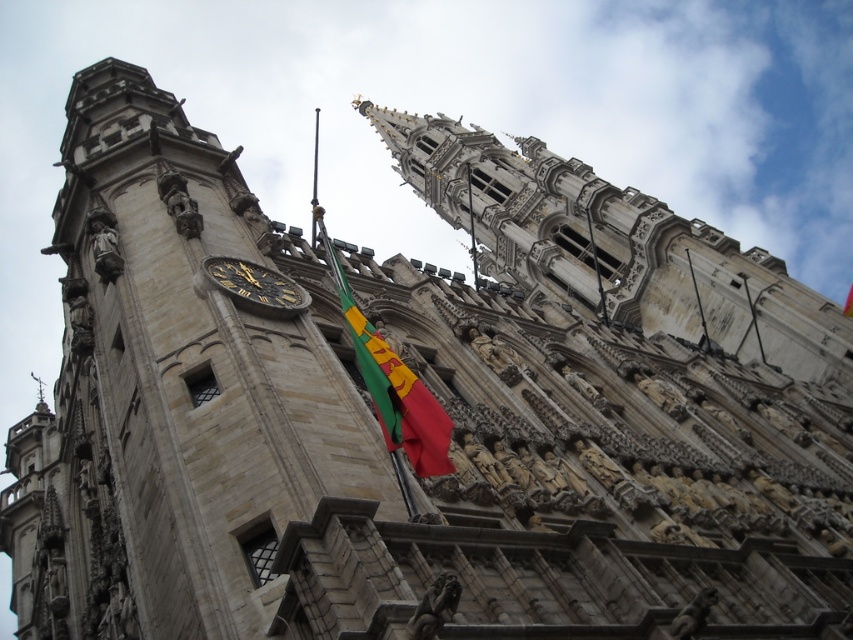
Question: Among these objects, which one is nearest to the camera?

Choices:
 (A) green fabric flag at center
 (B) dark brown stone clock at center

Answer: (A)

Question: In this image, where is green fabric flag at center located relative to dark brown stone clock at center?

Choices:
 (A) above
 (B) below

Answer: (B)

Question: Does green fabric flag at center appear on the right side of dark brown stone clock at center?

Choices:
 (A) no
 (B) yes

Answer: (B)

Question: Can you confirm if green fabric flag at center is smaller than dark brown stone clock at center?

Choices:
 (A) yes
 (B) no

Answer: (B)